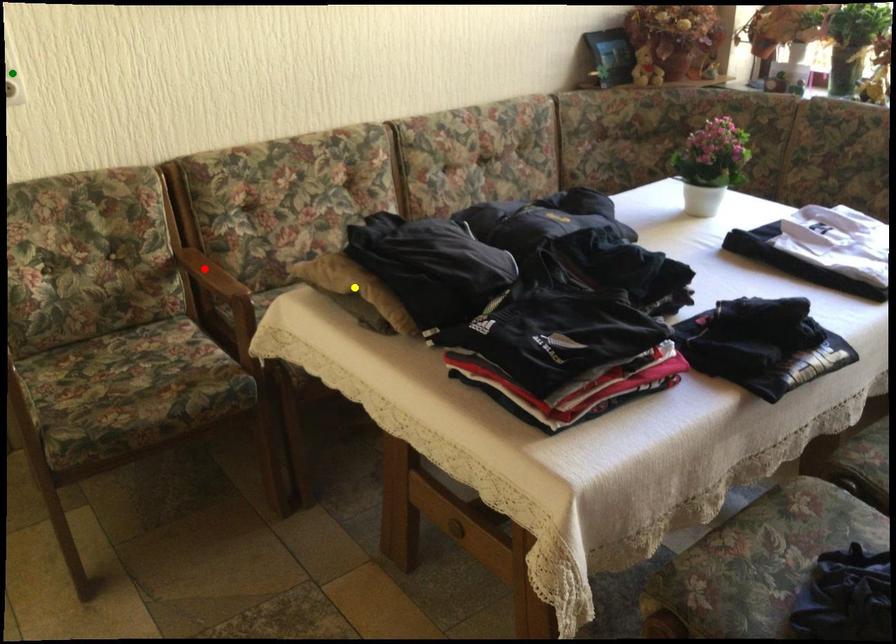
Order these from farthest to nearest:
red point | yellow point | green point

red point, green point, yellow point